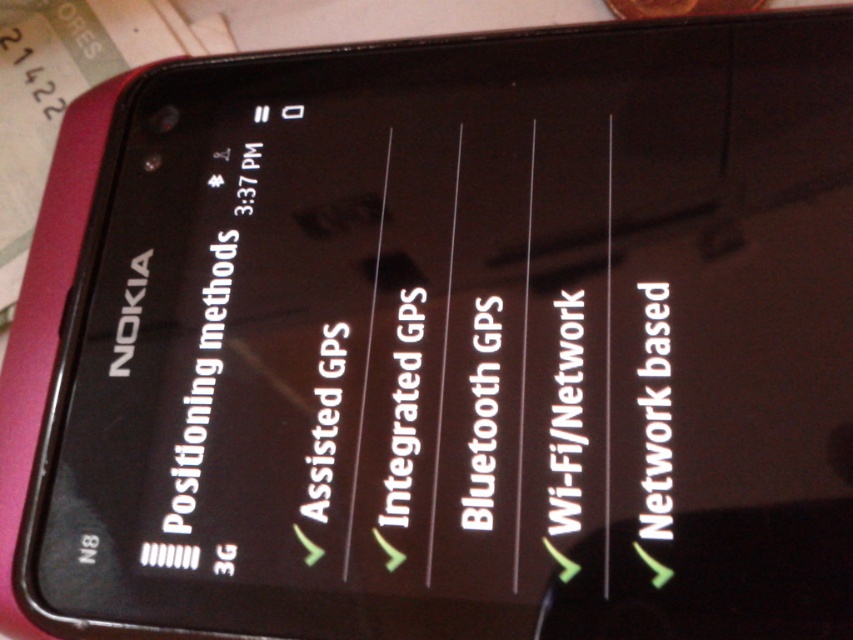
Is black glossy text at center right closer to the viewer compared to white text at center?

Yes, it is in front of white text at center.

Is black glossy text at center right above white text at center?

Indeed, black glossy text at center right is positioned over white text at center.

Which is behind, point (660, 397) or point (558, 410)?

Positioned behind is point (558, 410).

You are a GUI agent. You are given a task and a screenshot of the screen. Output one action in this format:
    pyautogui.click(x=<x>, y=<y>)
    Task: Click on the black glossy text at center right
    The width and height of the screenshot is (853, 640).
    Given the screenshot: What is the action you would take?
    pyautogui.click(x=656, y=413)

Does white text at center appear on the left side of white glossy text at center?

Incorrect, white text at center is not on the left side of white glossy text at center.

Image resolution: width=853 pixels, height=640 pixels. Describe the element at coordinates (566, 419) in the screenshot. I see `white text at center` at that location.

Find the location of a particular element. white text at center is located at coordinates (566, 419).

In the scene shown: Does black glossy text at center right appear on the left side of white glossy text at center?

No, black glossy text at center right is not to the left of white glossy text at center.

Does black glossy text at center right appear on the right side of white glossy text at center?

Yes, black glossy text at center right is to the right of white glossy text at center.

Does point (648, 289) come behind point (485, 321)?

No, (648, 289) is in front of (485, 321).

The width and height of the screenshot is (853, 640). In order to click on black glossy text at center right in this screenshot , I will do `click(656, 413)`.